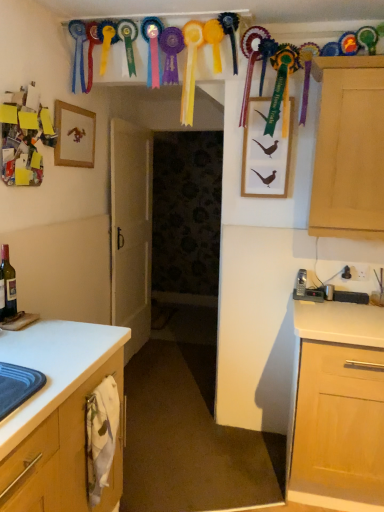
Question: Can you confirm if wooden picture frame at upper left, the first picture frame positioned from the left, is positioned to the left of wooden framed picture of birds at upper center, placed as the second picture frame when sorted from left to right?

Choices:
 (A) yes
 (B) no

Answer: (A)

Question: Is wooden picture frame at upper left, the first picture frame positioned from the left, thinner than wooden framed picture of birds at upper center, arranged as the 1th picture frame when viewed from the right?

Choices:
 (A) yes
 (B) no

Answer: (A)

Question: Can you confirm if wooden picture frame at upper left, the 2th picture frame from the right, is shorter than wooden framed picture of birds at upper center, placed as the second picture frame when sorted from left to right?

Choices:
 (A) no
 (B) yes

Answer: (B)

Question: Is wooden picture frame at upper left, the 2th picture frame from the right, closer to camera compared to wooden framed picture of birds at upper center, arranged as the 1th picture frame when viewed from the right?

Choices:
 (A) no
 (B) yes

Answer: (B)

Question: Is wooden picture frame at upper left, the 2th picture frame from the right, positioned beyond the bounds of wooden framed picture of birds at upper center, arranged as the 1th picture frame when viewed from the right?

Choices:
 (A) no
 (B) yes

Answer: (B)

Question: Does wooden picture frame at upper left, the 2th picture frame from the right, turn towards wooden framed picture of birds at upper center, placed as the second picture frame when sorted from left to right?

Choices:
 (A) yes
 (B) no

Answer: (A)

Question: Considering the relative sizes of matte glass bottle at left and white matte door at center in the image provided, is matte glass bottle at left thinner than white matte door at center?

Choices:
 (A) no
 (B) yes

Answer: (B)

Question: Does matte glass bottle at left lie in front of white matte door at center?

Choices:
 (A) yes
 (B) no

Answer: (A)

Question: From the image's perspective, is matte glass bottle at left located beneath white matte door at center?

Choices:
 (A) no
 (B) yes

Answer: (B)

Question: Considering the relative positions of matte glass bottle at left and white matte door at center in the image provided, is matte glass bottle at left to the left of white matte door at center from the viewer's perspective?

Choices:
 (A) no
 (B) yes

Answer: (B)

Question: Considering the relative sizes of matte glass bottle at left and white matte door at center in the image provided, is matte glass bottle at left wider than white matte door at center?

Choices:
 (A) yes
 (B) no

Answer: (B)

Question: Is the depth of matte glass bottle at left greater than that of white matte door at center?

Choices:
 (A) no
 (B) yes

Answer: (A)

Question: Considering the relative sizes of matte glass bottle at left and light wood cabinet at right in the image provided, is matte glass bottle at left thinner than light wood cabinet at right?

Choices:
 (A) yes
 (B) no

Answer: (A)